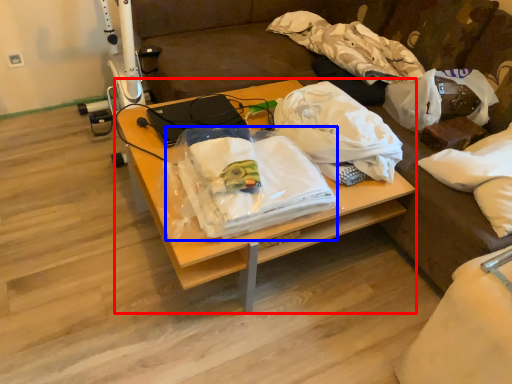
Question: Which object is closer to the camera taking this photo, desk (highlighted by a red box) or cloth (highlighted by a blue box)?

Choices:
 (A) desk
 (B) cloth

Answer: (B)